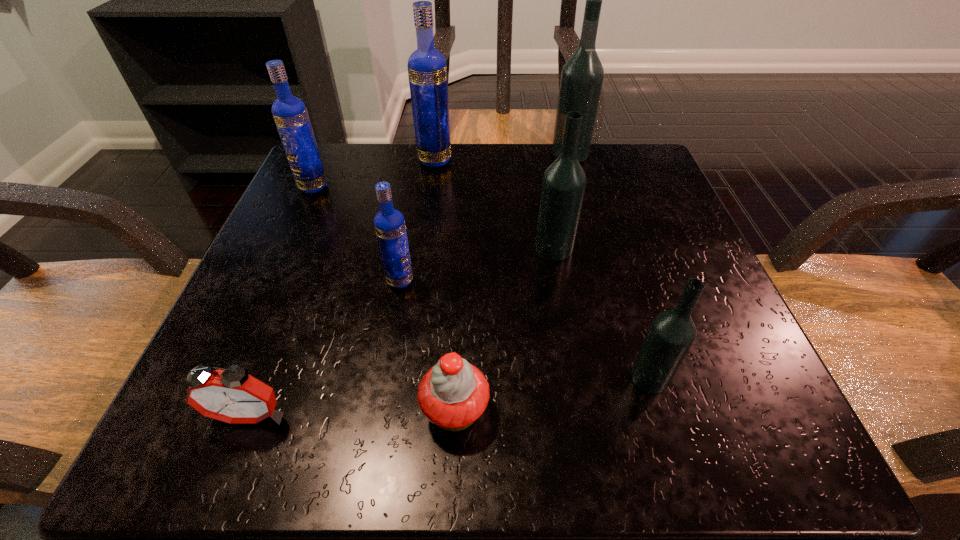
You are a GUI agent. You are given a task and a screenshot of the screen. Output one action in this format:
    pyautogui.click(x=<x>, y=<y>)
    Task: Click on the free point between the second nearest vodka and the alarm clock
    The image size is (960, 540).
    Given the screenshot: What is the action you would take?
    pyautogui.click(x=324, y=348)

At what (x,y) coordinates should I click in order to perform the action: click on free point between the alarm clock and the second nearest vodka. Please return your answer as a coordinate pair (x, y). The width and height of the screenshot is (960, 540). Looking at the image, I should click on (324, 348).

The image size is (960, 540). I want to click on vacant region between the farthest blue vodka and the alarm clock, so click(343, 287).

Locate which object is the fifth closest to the biggest black vodka. Please provide its 2D coordinates. Your answer should be formatted as a tuple, i.e. [(x, y)], where the tuple contains the x and y coordinates of a point satisfying the conditions above.

[(671, 334)]

Find the location of a particular element. This screenshot has width=960, height=540. object that stands as the closest to the nearest blue vodka is located at coordinates (453, 394).

Image resolution: width=960 pixels, height=540 pixels. I want to click on vodka that is the second closest to the alarm clock, so coord(564,181).

Identify which vodka is located as the nearest to the smallest black vodka. Please provide its 2D coordinates. Your answer should be formatted as a tuple, i.e. [(x, y)], where the tuple contains the x and y coordinates of a point satisfying the conditions above.

[(564, 181)]

Identify the location of blue vodka that is the second closest to the sixth nearest object. (389, 223).

The width and height of the screenshot is (960, 540). Identify the location of the third closest blue vodka relative to the second smallest black vodka. (290, 114).

The width and height of the screenshot is (960, 540). In order to click on the second closest black vodka to the fourth nearest object in this screenshot , I will do `click(671, 334)`.